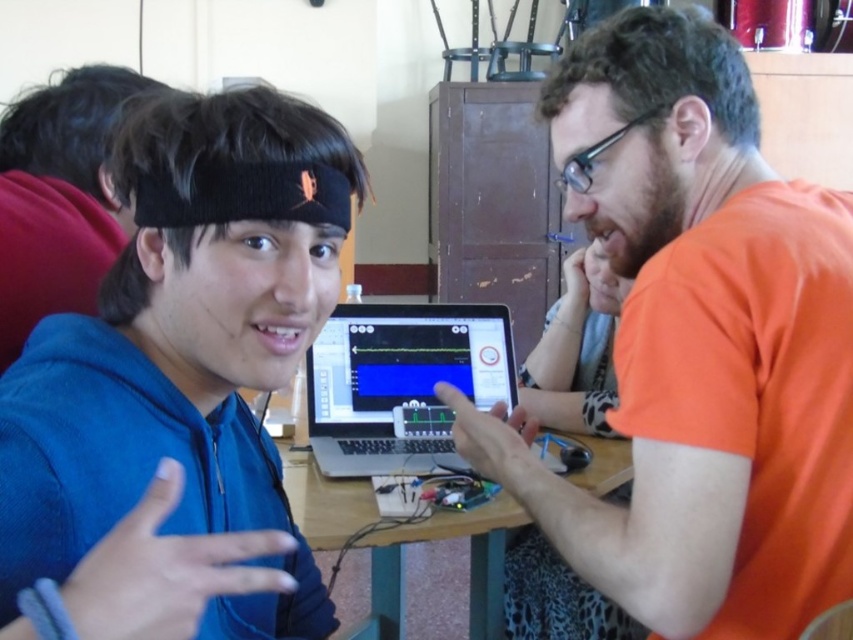
Which is more to the left, blue fleece jacket at center or satin silver laptop at center?

blue fleece jacket at center

Who is lower down, blue fleece jacket at center or satin silver laptop at center?

blue fleece jacket at center is lower down.

Find the location of `blue fleece jacket at center`. blue fleece jacket at center is located at coordinates (184, 348).

Where is `blue fleece jacket at center`? The width and height of the screenshot is (853, 640). blue fleece jacket at center is located at coordinates (184, 348).

This screenshot has width=853, height=640. Identify the location of orange matte shirt at right. (699, 344).

Is the position of orange matte shirt at right less distant than that of blue fleece jacket at center?

No, it is not.

Does point (738, 492) come behind point (292, 608)?

No, it is in front of (292, 608).

Find the location of a particular element. Image resolution: width=853 pixels, height=640 pixels. orange matte shirt at right is located at coordinates (699, 344).

Between orange matte shirt at right and satin silver laptop at center, which one is positioned higher?

orange matte shirt at right is above.

Can you confirm if orange matte shirt at right is positioned below satin silver laptop at center?

Incorrect, orange matte shirt at right is not positioned below satin silver laptop at center.

Which is behind, point (653, 490) or point (389, 436)?

The point (389, 436) is more distant.

Locate an element on the screen. This screenshot has width=853, height=640. orange matte shirt at right is located at coordinates (699, 344).